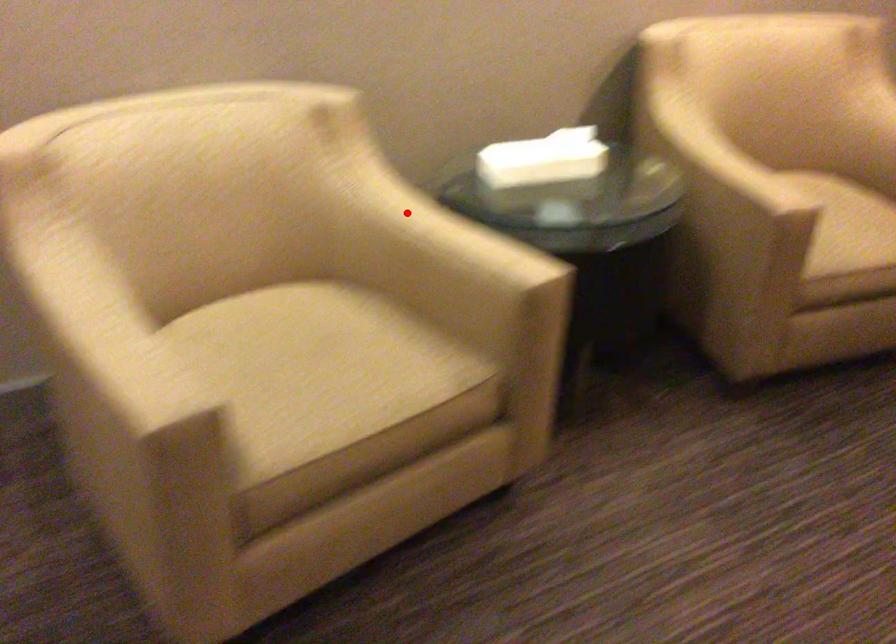
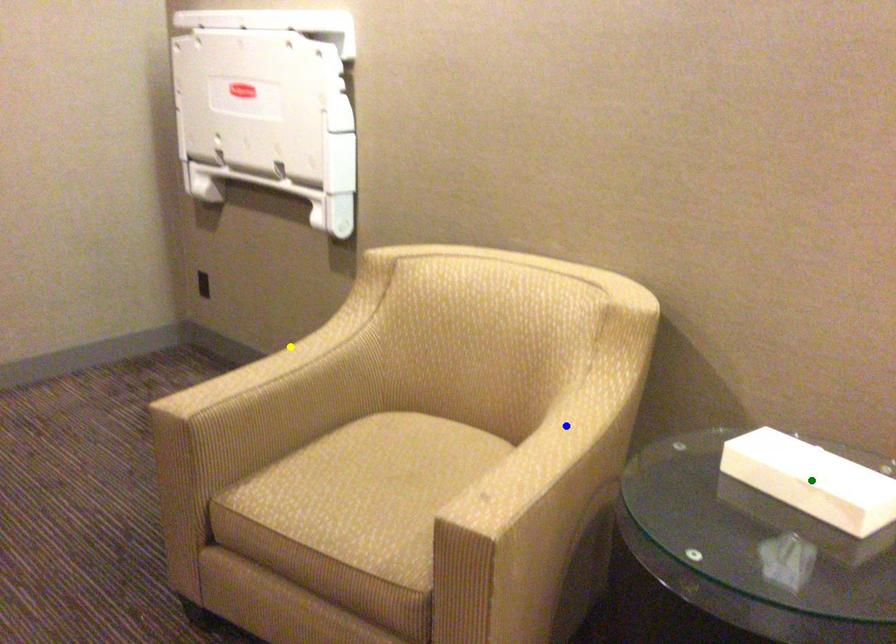
Question: I am providing you with two images of the same scene from different viewpoints. A red point is marked on the first image. You are given multiple points on the second image. Which point in image 2 is actually the same real-world point as the red point in image 1?

Choices:
 (A) yellow point
 (B) blue point
 (C) green point

Answer: (B)